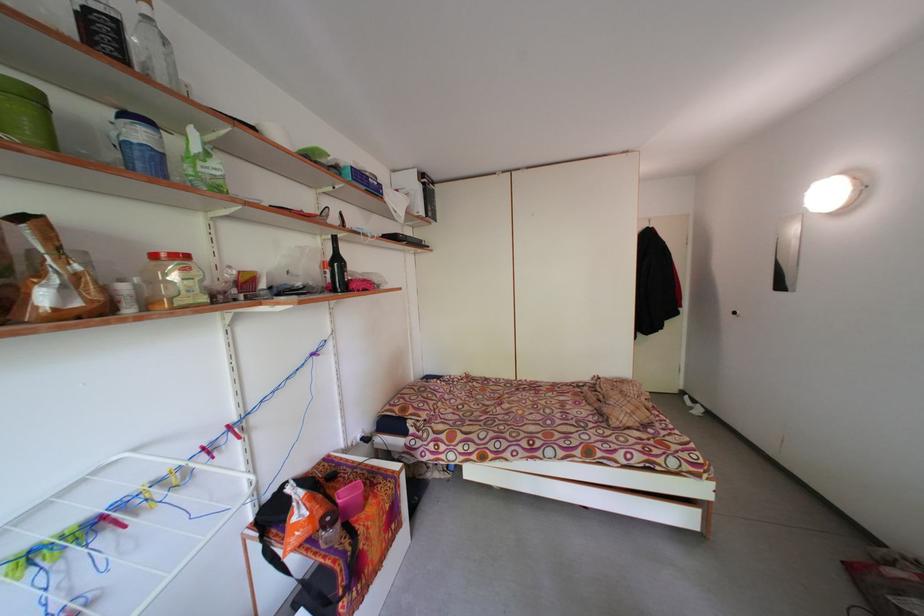
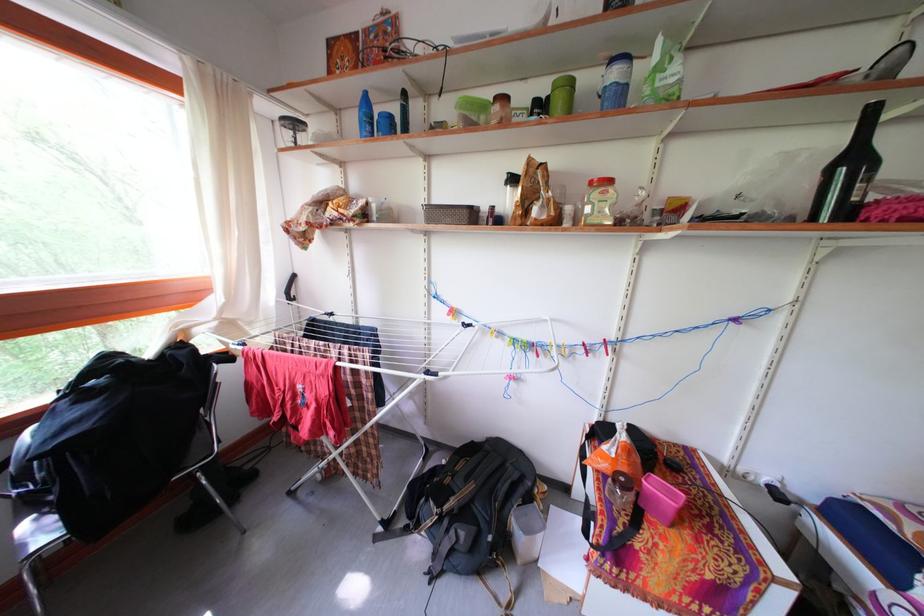
Find the pixel in the second image that matches point (197, 290) in the first image.

(611, 211)